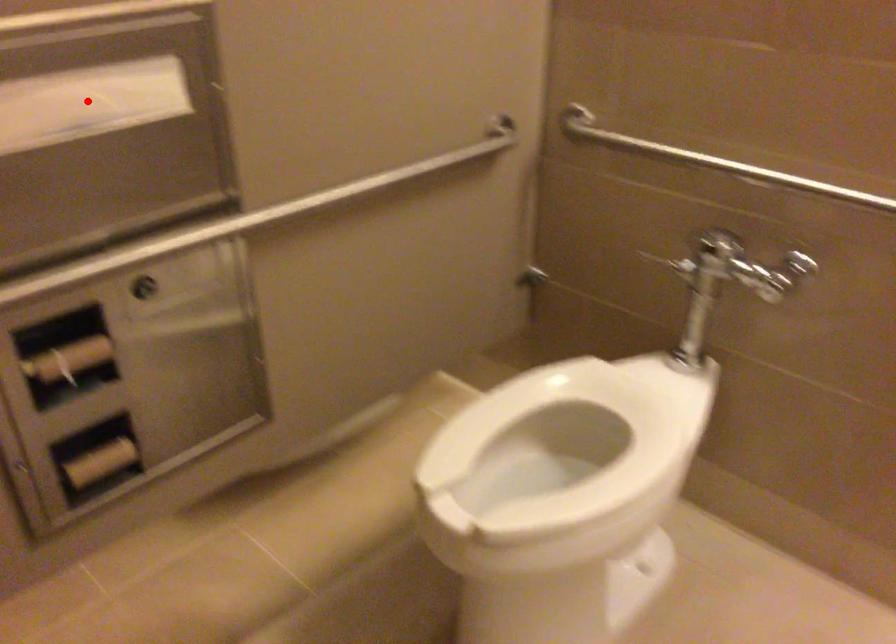
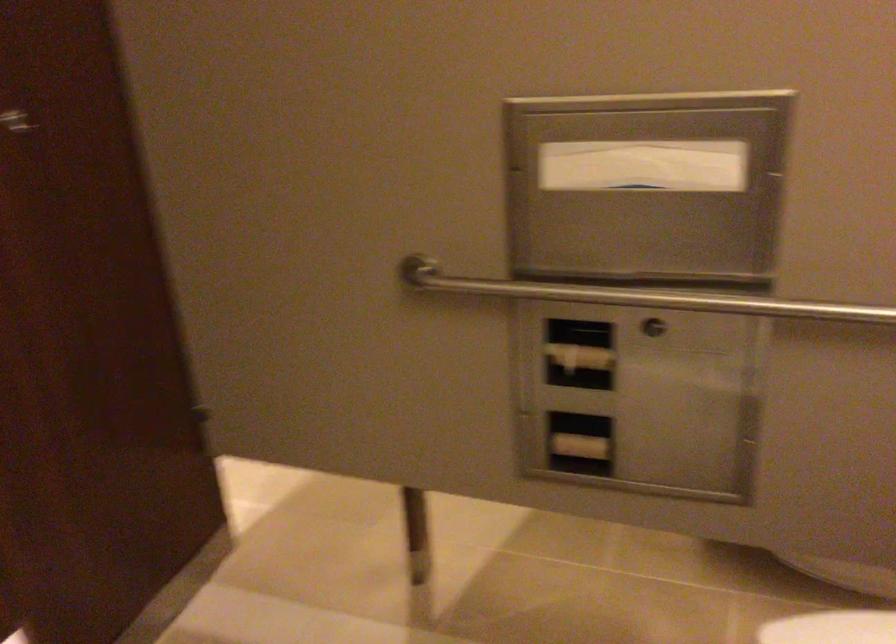
Question: I am providing you with two images of the same scene from different viewpoints. In image1, a red point is highlighted. Considering the same 3D point in image2, which of the following is correct?

Choices:
 (A) It is closer
 (B) It is farther

Answer: (B)